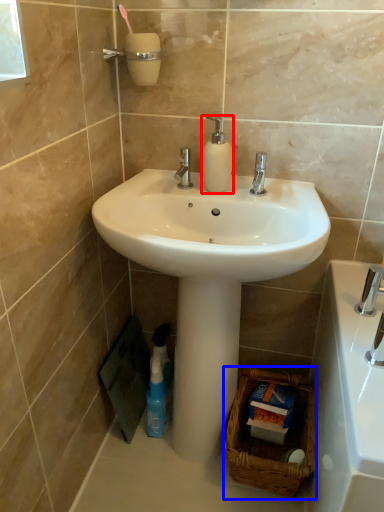
Question: Which object is further to the camera taking this photo, soap dispenser (highlighted by a red box) or basket (highlighted by a blue box)?

Choices:
 (A) soap dispenser
 (B) basket

Answer: (B)